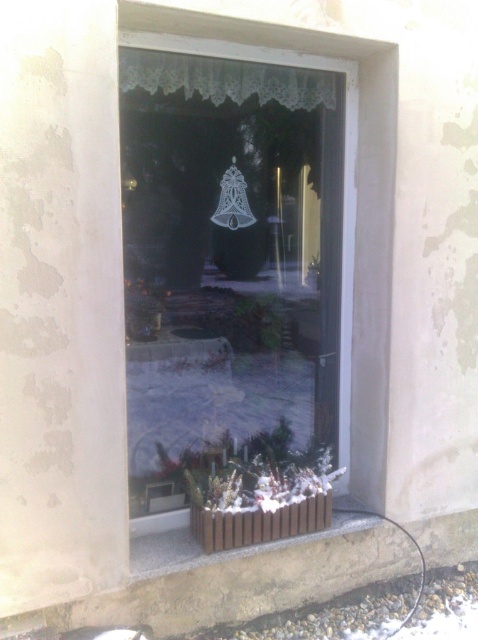
Which is in front, point (71, 609) or point (305, 108)?

Point (71, 609)

Is brown wooden curb at lower center below white lace curtain at upper center?

Indeed, brown wooden curb at lower center is positioned under white lace curtain at upper center.

Between point (243, 596) and point (188, 60), which one is positioned in front?

Point (188, 60) is more forward.

The image size is (478, 640). What are the coordinates of `brown wooden curb at lower center` in the screenshot? It's located at (239, 582).

Can you confirm if transparent glass bell at center is wider than white lace curtain at upper center?

Correct, the width of transparent glass bell at center exceeds that of white lace curtain at upper center.

Is point (147, 419) farther from viewer compared to point (283, 76)?

Yes, it is.

Image resolution: width=478 pixels, height=640 pixels. Identify the location of transparent glass bell at center. (228, 260).

In the scene shown: How distant is transparent glass bell at center from brown wooden curb at lower center?

1.01 meters

Is point (270, 420) farther from viewer compared to point (208, 579)?

Yes.

The height and width of the screenshot is (640, 478). Find the location of `transparent glass bell at center`. transparent glass bell at center is located at coordinates (228, 260).